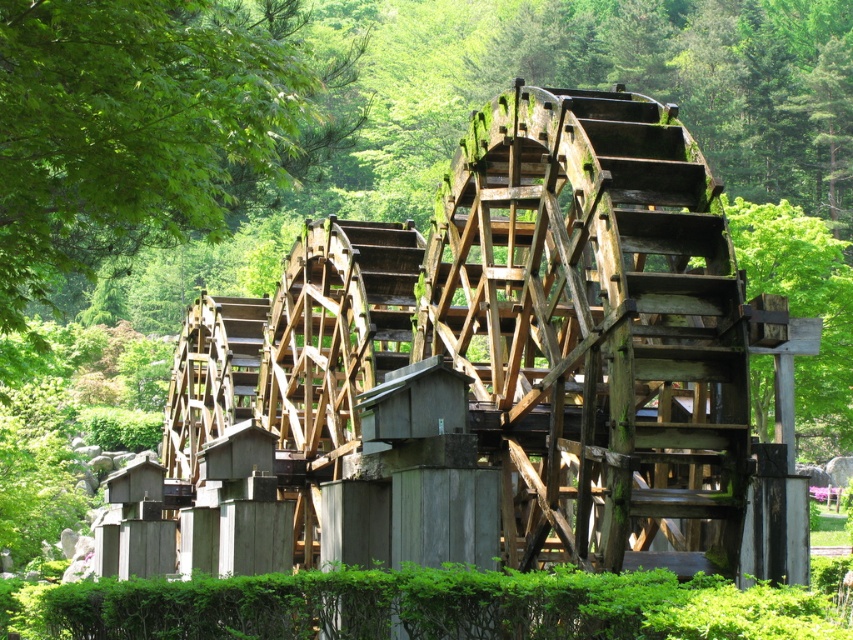
You are standing in front of the wooden waterwheel at center and want to take a photo of the green leafy tree at upper left. Since the tree is partially hidden by the waterwheel, will you need to move closer to the waterwheel or farther away from it to get a clear view of the tree?

The green leafy tree at upper left is closer to the viewer than wooden waterwheel at center, so to get a clearer view of the tree, you should move farther away from the wooden waterwheel at center. This will help reduce the obstruction caused by the waterwheel between you and the tree.

You are standing at the center of the waterwheel and want to locate the green leafy tree at upper left. In which direction should you look?

The green leafy tree at upper left is located at point (x=149, y=125), which is to the upper left direction from the center of the waterwheel. So you should look towards the upper left direction.